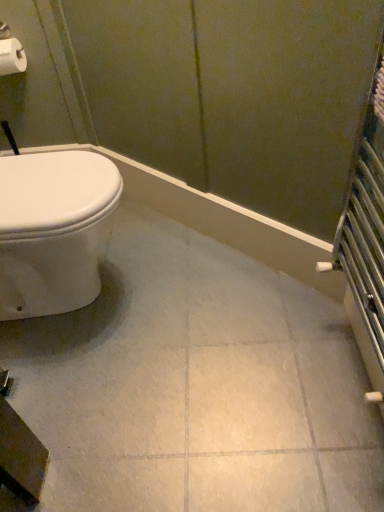
The width and height of the screenshot is (384, 512). Identify the location of white matte toilet paper at upper left. (12, 57).

Measure the distance between point (x=5, y=41) and camera.

The depth of point (x=5, y=41) is 4.96 feet.

The image size is (384, 512). What do you see at coordinates (12, 57) in the screenshot?
I see `white matte toilet paper at upper left` at bounding box center [12, 57].

The width and height of the screenshot is (384, 512). I want to click on white glossy ceramic tile at center, so click(196, 386).

What do you see at coordinates (196, 386) in the screenshot? This screenshot has width=384, height=512. I see `white glossy ceramic tile at center` at bounding box center [196, 386].

Locate an element on the screen. white matte toilet paper at upper left is located at coordinates (12, 57).

Considering the relative positions of white glossy ceramic tile at center and white matte toilet paper at upper left in the image provided, is white glossy ceramic tile at center to the right of white matte toilet paper at upper left from the viewer's perspective?

Yes.

Is white glossy ceramic tile at center closer to camera compared to white matte toilet paper at upper left?

Yes, it is.

Considering the points (267, 315) and (10, 66), which point is in front, point (267, 315) or point (10, 66)?

The point (267, 315) is closer to the camera.

From the image's perspective, which is below, white glossy ceramic tile at center or white matte toilet paper at upper left?

white glossy ceramic tile at center is shown below in the image.

From a real-world perspective, who is located higher, white glossy ceramic tile at center or white matte toilet paper at upper left?

white matte toilet paper at upper left.

Can you confirm if white glossy ceramic tile at center is wider than white matte toilet paper at upper left?

Yes, white glossy ceramic tile at center is wider than white matte toilet paper at upper left.

Which of these two, white glossy ceramic tile at center or white matte toilet paper at upper left, stands taller?

white matte toilet paper at upper left.

Considering the sizes of objects white glossy ceramic tile at center and white matte toilet paper at upper left in the image provided, who is bigger, white glossy ceramic tile at center or white matte toilet paper at upper left?

white glossy ceramic tile at center is bigger.

Is white glossy ceramic tile at center outside of white matte toilet paper at upper left?

Yes, white glossy ceramic tile at center is not within white matte toilet paper at upper left.

Can you see white glossy ceramic tile at center touching white matte toilet paper at upper left?

No, white glossy ceramic tile at center is not with white matte toilet paper at upper left.

Is white glossy ceramic tile at center aimed at white matte toilet paper at upper left?

No, white glossy ceramic tile at center is not facing towards white matte toilet paper at upper left.

What's the angular difference between white glossy ceramic tile at center and white matte toilet paper at upper left's facing directions?

The facing directions of white glossy ceramic tile at center and white matte toilet paper at upper left are 90.8 degrees apart.

Locate an element on the screen. toilet paper that is behind the white glossy ceramic tile at center is located at coordinates (12, 57).

Which is more to the left, white matte toilet paper at upper left or white glossy ceramic tile at center?

white matte toilet paper at upper left is more to the left.

Who is more distant, white matte toilet paper at upper left or white glossy ceramic tile at center?

white matte toilet paper at upper left is behind.

Considering the points (17, 72) and (153, 215), which point is in front, point (17, 72) or point (153, 215)?

The point (17, 72) is closer.

From the image's perspective, is white matte toilet paper at upper left located beneath white glossy ceramic tile at center?

No.

From a real-world perspective, between white matte toilet paper at upper left and white glossy ceramic tile at center, who is vertically lower?

In real-world perspective, white glossy ceramic tile at center is lower.

From the picture: Considering the sizes of white matte toilet paper at upper left and white glossy ceramic tile at center in the image, is white matte toilet paper at upper left wider or thinner than white glossy ceramic tile at center?

Considering their sizes, white matte toilet paper at upper left looks slimmer than white glossy ceramic tile at center.

Which of these two, white matte toilet paper at upper left or white glossy ceramic tile at center, stands taller?

With more height is white matte toilet paper at upper left.

Considering the relative sizes of white matte toilet paper at upper left and white glossy ceramic tile at center in the image provided, is white matte toilet paper at upper left bigger than white glossy ceramic tile at center?

Actually, white matte toilet paper at upper left might be smaller than white glossy ceramic tile at center.

Do you think white matte toilet paper at upper left is within white glossy ceramic tile at center, or outside of it?

white matte toilet paper at upper left is spatially situated outside white glossy ceramic tile at center.

Consider the image. Is white matte toilet paper at upper left not near white glossy ceramic tile at center?

Indeed, white matte toilet paper at upper left is not near white glossy ceramic tile at center.

Is white matte toilet paper at upper left facing away from white glossy ceramic tile at center?

white matte toilet paper at upper left does not have its back to white glossy ceramic tile at center.

Locate an element on the screen. toilet paper above the white glossy ceramic tile at center (from a real-world perspective) is located at coordinates (12, 57).

At what (x,y) coordinates should I click in order to perform the action: click on ceramic tile below the white matte toilet paper at upper left (from a real-world perspective). Please return your answer as a coordinate pair (x, y). Looking at the image, I should click on (196, 386).

At what (x,y) coordinates should I click in order to perform the action: click on ceramic tile on the right of white matte toilet paper at upper left. Please return your answer as a coordinate pair (x, y). This screenshot has height=512, width=384. Looking at the image, I should click on (196, 386).